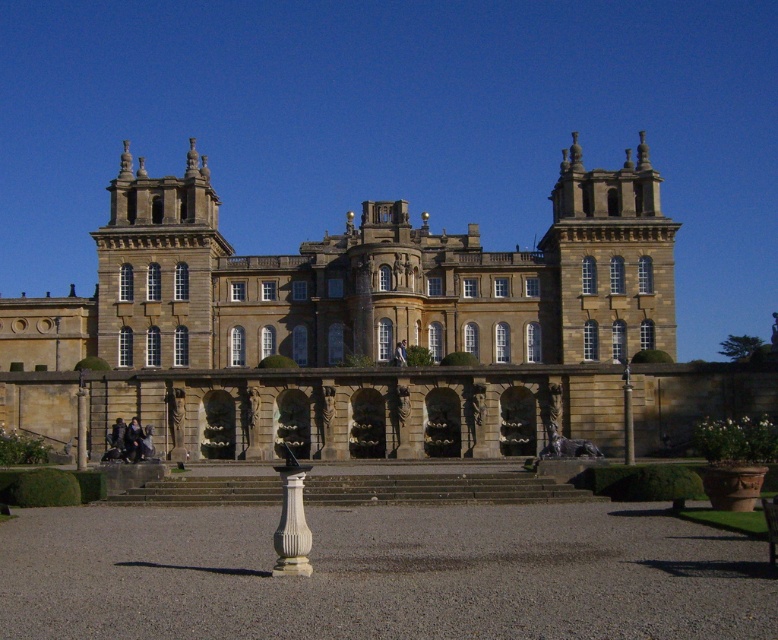
You are planning to take a photo of the brown stone palace at center and the white marble column at center in the courtyard. Since you want both objects to appear in the frame, which object should you position closer to the camera to ensure both fit in the photo?

To ensure both the brown stone palace at center and the white marble column at center fit in the photo, you should position the brown stone palace at center closer to the camera. Since the brown stone palace at center is wider than the white marble column at center, placing it closer will help balance their sizes in the frame.

You are standing in the courtyard of the brown stone palace at center and want to take a photo of the white marble column at center. Which direction should you face to ensure the column is in the foreground of your photo?

You should face towards the white marble column at center. Since the brown stone palace at center is further away from you than the white marble column at center, facing towards the column will place it in the foreground of your photo.